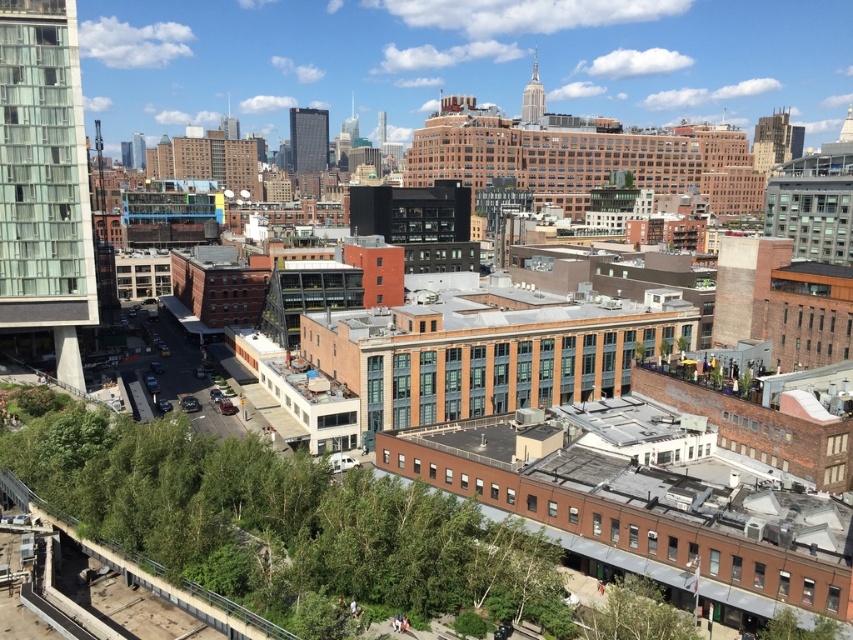
Looking at this image, you are a city planner reviewing this area. You need to determine if the green leafy tree at lower center obstructs the view of the matte glass skyscraper at upper center from the park pathway. Based on the image, what can you conclude?

The green leafy tree at lower center is in front of the matte glass skyscraper at upper center, so it does obstruct the view of the matte glass skyscraper at upper center from the park pathway.

In the scene shown: You are a city planner evaluating the urban layout. Considering the green leafy tree at lower center and the matte glass skyscraper at upper center, which object appears larger in the scene?

The matte glass skyscraper at upper center appears larger than the green leafy tree at lower center.

You are standing at the pedestrian bridge in the foreground of the urban landscape. You see two points marked in the image. Which point, point (21, 140) or point (538, 99), is closer to you?

Point (21, 140) is closer to you because it is closer to the camera than point (538, 99).